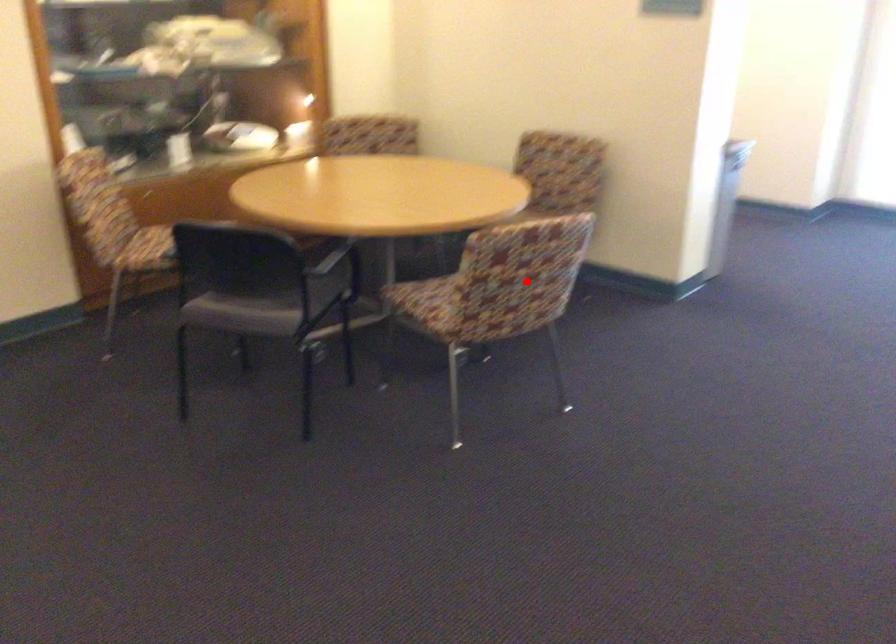
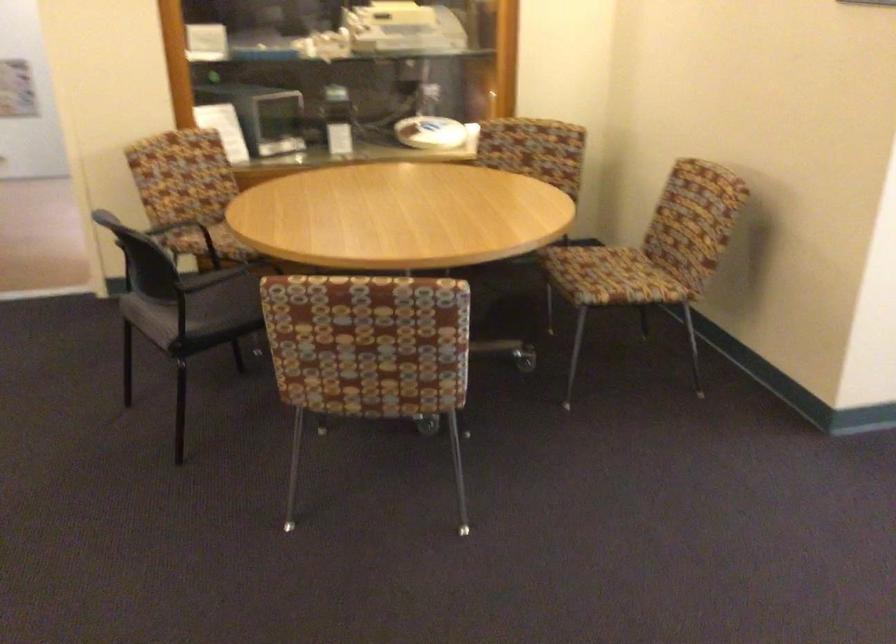
Question: I am providing you with two images of the same scene from different viewpoints. Image1 has a red point marked. In image2, the corresponding 3D location appears at what relative position? Reply with the corresponding letter.

Choices:
 (A) Closer
 (B) Farther

Answer: (A)